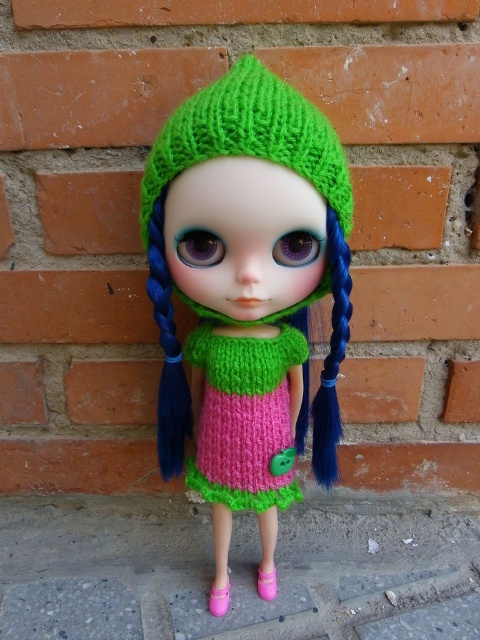
Question: Can you confirm if green knitted hat at center is positioned above bluehairpigtail at right?

Choices:
 (A) no
 (B) yes

Answer: (B)

Question: Which object is closer to the camera taking this photo?

Choices:
 (A) pink knitted dress at center
 (B) bluehairpigtail at center
 (C) green knitted doll at center

Answer: (C)

Question: Based on their relative distances, which object is farther from the green knitted doll at center?

Choices:
 (A) bluehairpigtail at right
 (B) pink knitted dress at center

Answer: (A)

Question: Which is nearer to the green knitted hat at center?

Choices:
 (A) bluehairpigtail at center
 (B) pink knitted dress at center
 (C) green knitted doll at center

Answer: (C)

Question: In this image, where is green knitted doll at center located relative to pink knitted dress at center?

Choices:
 (A) right
 (B) left

Answer: (B)

Question: Can you confirm if green knitted doll at center is positioned above pink knitted dress at center?

Choices:
 (A) yes
 (B) no

Answer: (A)